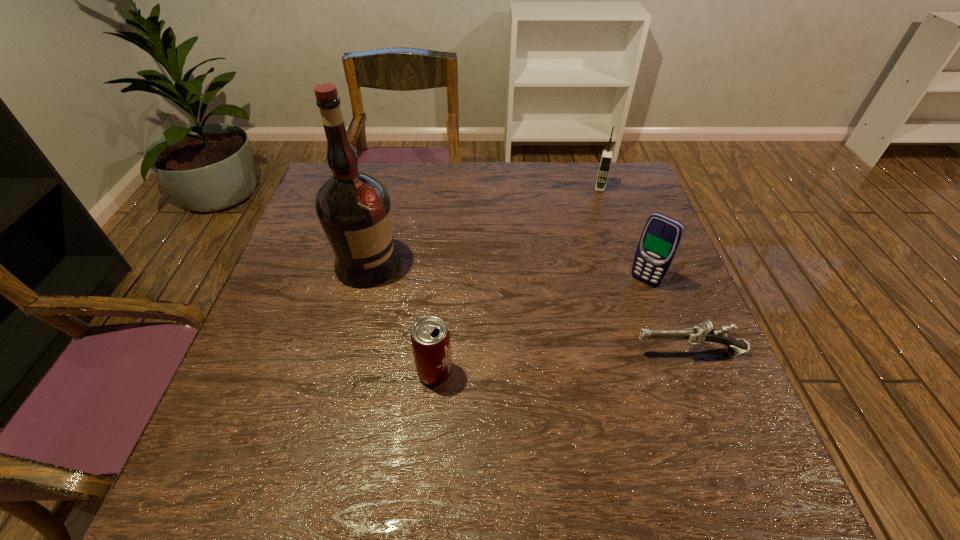
I want to click on free space between the beer can and the farthest object, so click(517, 280).

Find the location of a particular element. This screenshot has width=960, height=540. vacant space that's between the beer can and the nearer cellular telephone is located at coordinates (540, 327).

The image size is (960, 540). I want to click on free point between the beer can and the nearer cellular telephone, so click(x=540, y=327).

Identify the location of vacant space in between the nearer cellular telephone and the fourth object from right to left. This screenshot has height=540, width=960. (540, 327).

This screenshot has width=960, height=540. What are the coordinates of `vacant point located between the fourth object from right to left and the leftmost object` in the screenshot? It's located at (401, 319).

Identify the location of free space that is in between the nearer cellular telephone and the farthest object. (622, 234).

Identify the location of vacant space that's between the nearer cellular telephone and the tallest object. point(507,273).

The height and width of the screenshot is (540, 960). I want to click on free point between the gun and the nearer cellular telephone, so click(666, 317).

Point out which object is positioned as the second nearest to the leftmost object. Please provide its 2D coordinates. Your answer should be formatted as a tuple, i.e. [(x, y)], where the tuple contains the x and y coordinates of a point satisfying the conditions above.

[(703, 335)]

Identify the location of the closest object to the farthest object. The image size is (960, 540). (661, 237).